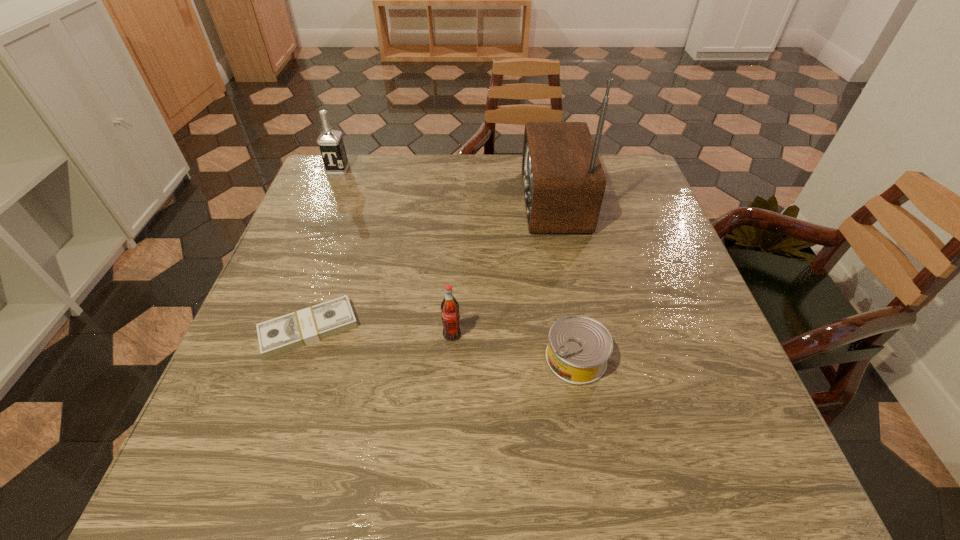
This screenshot has height=540, width=960. I want to click on free spot between the soda bottle and the radio receiver, so click(502, 268).

Find the location of `vacant region between the fourth tallest object and the dollar`. vacant region between the fourth tallest object and the dollar is located at coordinates (443, 343).

This screenshot has height=540, width=960. In order to click on vacant point located between the vodka and the tallest object in this screenshot , I will do `click(445, 186)`.

I want to click on free space between the shortest object and the third tallest object, so click(x=380, y=332).

Select which object is the third closest to the third object from right to left. Please provide its 2D coordinates. Your answer should be formatted as a tuple, i.e. [(x, y)], where the tuple contains the x and y coordinates of a point satisfying the conditions above.

[(563, 180)]

The width and height of the screenshot is (960, 540). I want to click on the fourth closest object to the dollar, so click(330, 141).

Image resolution: width=960 pixels, height=540 pixels. What are the coordinates of `free space that satisfies the following two spatial constraints: 1. on the front-facing side of the tallest object; 2. on the label of the third object from right to left` in the screenshot? It's located at (577, 335).

At what (x,y) coordinates should I click in order to perform the action: click on free spot that satisfies the following two spatial constraints: 1. on the front label of the vodka; 2. on the right side of the fourth tallest object. Please return your answer as a coordinate pair (x, y). The image size is (960, 540). Looking at the image, I should click on 262,358.

Locate an element on the screen. This screenshot has width=960, height=540. blank space that satisfies the following two spatial constraints: 1. on the front-facing side of the radio receiver; 2. on the label of the soda bottle is located at coordinates (577, 335).

Where is `vacant space that satisfies the following two spatial constraints: 1. on the front-facing side of the radio receiver; 2. on the label of the third object from right to left`? vacant space that satisfies the following two spatial constraints: 1. on the front-facing side of the radio receiver; 2. on the label of the third object from right to left is located at coordinates (577, 335).